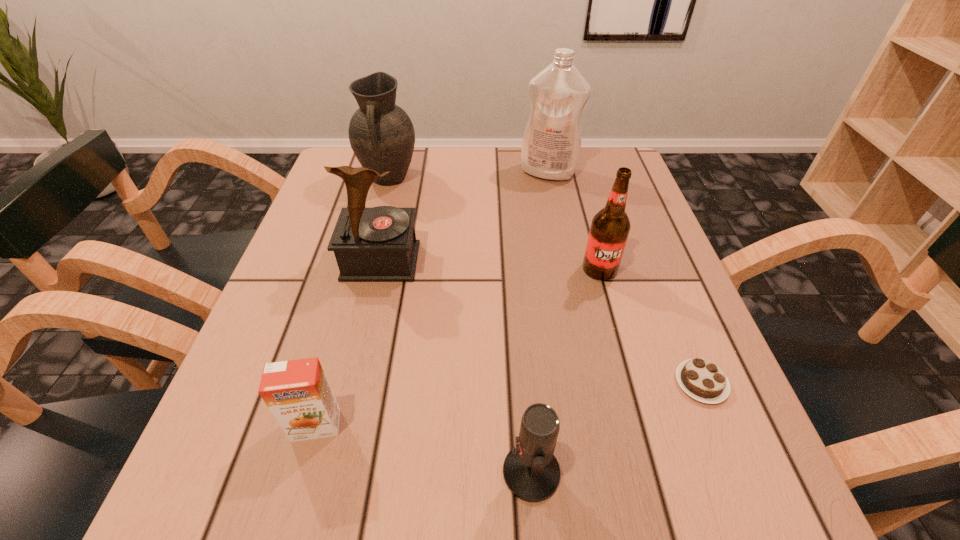
I want to click on the tallest object, so click(551, 145).

Locate an element on the screen. Image resolution: width=960 pixels, height=540 pixels. pitcher is located at coordinates (381, 134).

Where is `phonograph_record`? This screenshot has width=960, height=540. phonograph_record is located at coordinates (378, 244).

Locate an element on the screen. The width and height of the screenshot is (960, 540). root beer is located at coordinates (610, 227).

I want to click on the nearest object, so click(531, 472).

Locate an element on the screen. The image size is (960, 540). the sixth farthest object is located at coordinates (297, 392).

Identify the location of chocolate cake. This screenshot has height=540, width=960. (701, 379).

Identify the location of the rightmost object. This screenshot has height=540, width=960. (701, 379).

Locate an element on the screen. Image resolution: width=960 pixels, height=540 pixels. vacant space located on the left of the tallest object is located at coordinates pyautogui.click(x=405, y=172).

You are a GUI agent. You are given a task and a screenshot of the screen. Output one action in this format:
    pyautogui.click(x=<x>, y=<y>)
    Task: Click on the free region located on the side of the pitcher with the handle
    This screenshot has height=540, width=960.
    Given the screenshot: What is the action you would take?
    pyautogui.click(x=374, y=232)